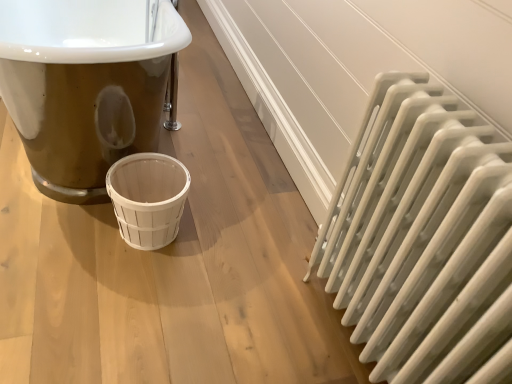
The width and height of the screenshot is (512, 384). What are the coordinates of `free space behind white wood basket at center` in the screenshot? It's located at (209, 183).